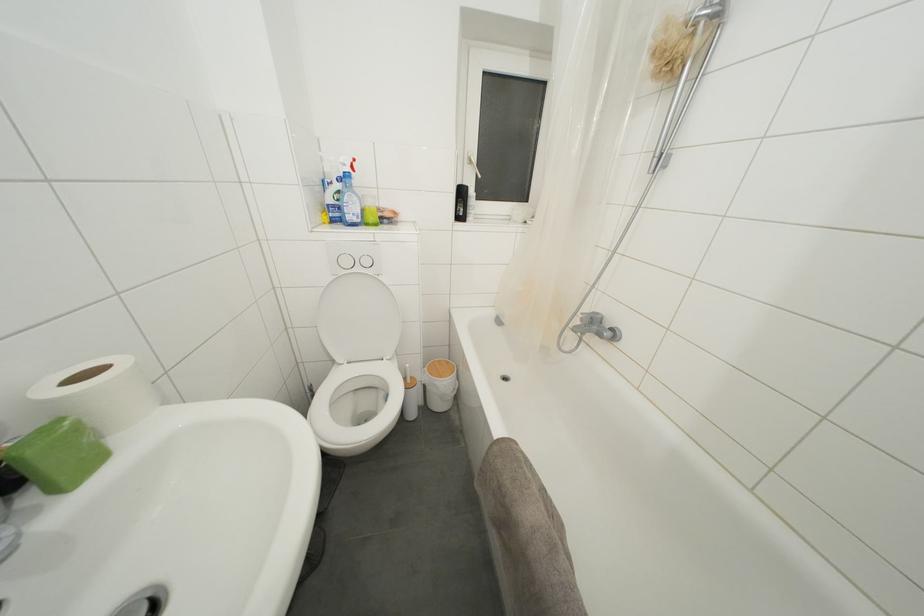
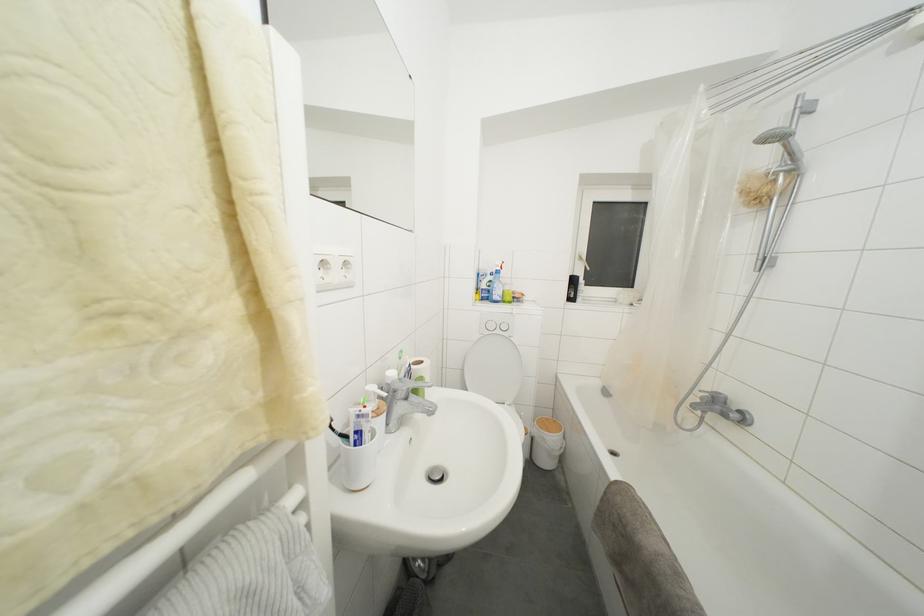
Find the pixel in the second image that matches [391,224] in the first image.

(520, 304)